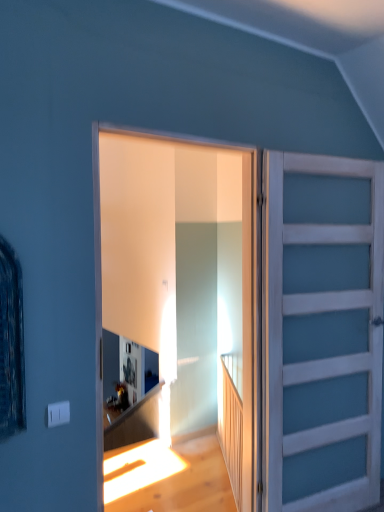
Question: Does translucent glass door at center, marked as the second door in a right-to-left arrangement, touch wooden at right?

Choices:
 (A) yes
 (B) no

Answer: (B)

Question: Does translucent glass door at center, marked as the second door in a right-to-left arrangement, come in front of wooden at right?

Choices:
 (A) yes
 (B) no

Answer: (A)

Question: From the image's perspective, does translucent glass door at center, which is counted as the 1th door, starting from the left, appear lower than wooden at right?

Choices:
 (A) yes
 (B) no

Answer: (B)

Question: Does translucent glass door at center, which is counted as the 1th door, starting from the left, have a greater width compared to wooden at right?

Choices:
 (A) no
 (B) yes

Answer: (B)

Question: Considering the relative sizes of translucent glass door at center, which is counted as the 1th door, starting from the left, and wooden at right in the image provided, is translucent glass door at center, which is counted as the 1th door, starting from the left, bigger than wooden at right?

Choices:
 (A) yes
 (B) no

Answer: (A)

Question: From a real-world perspective, is translucent glass door at center, which is counted as the 1th door, starting from the left, positioned under wooden at right based on gravity?

Choices:
 (A) no
 (B) yes

Answer: (A)

Question: Is wooden at right aimed at white painted wood door at right, the 1th door from the right?

Choices:
 (A) yes
 (B) no

Answer: (B)

Question: Is white painted wood door at right, the 2th door when ordered from left to right, surrounded by wooden at right?

Choices:
 (A) yes
 (B) no

Answer: (B)

Question: Is wooden at right oriented away from white painted wood door at right, the 1th door from the right?

Choices:
 (A) no
 (B) yes

Answer: (A)

Question: Considering the relative positions of wooden at right and white painted wood door at right, the 2th door when ordered from left to right, in the image provided, is wooden at right in front of white painted wood door at right, the 2th door when ordered from left to right,?

Choices:
 (A) no
 (B) yes

Answer: (A)

Question: Is wooden at right not close to white painted wood door at right, the 1th door from the right?

Choices:
 (A) yes
 (B) no

Answer: (B)

Question: Is the position of wooden at right more distant than that of white painted wood door at right, the 1th door from the right?

Choices:
 (A) yes
 (B) no

Answer: (A)

Question: Is white painted wood door at right, the 2th door when ordered from left to right, bigger than translucent glass door at center, which is counted as the 1th door, starting from the left?

Choices:
 (A) yes
 (B) no

Answer: (A)